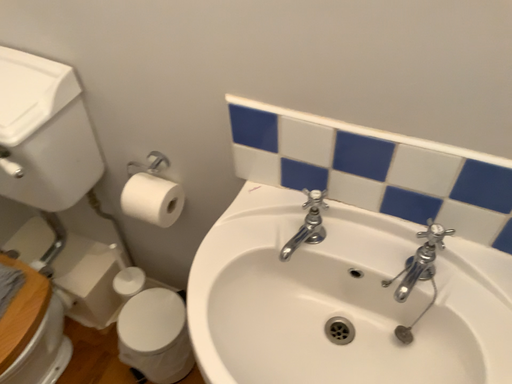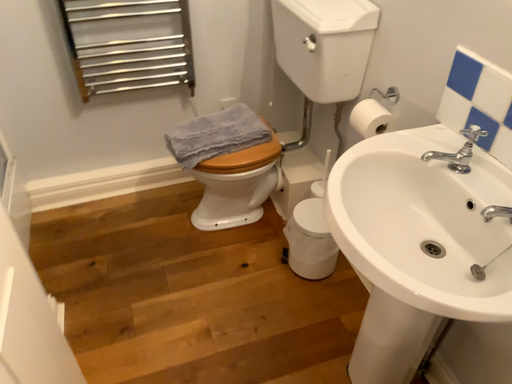
Question: Which way did the camera rotate in the video?

Choices:
 (A) rotated right
 (B) rotated left

Answer: (B)